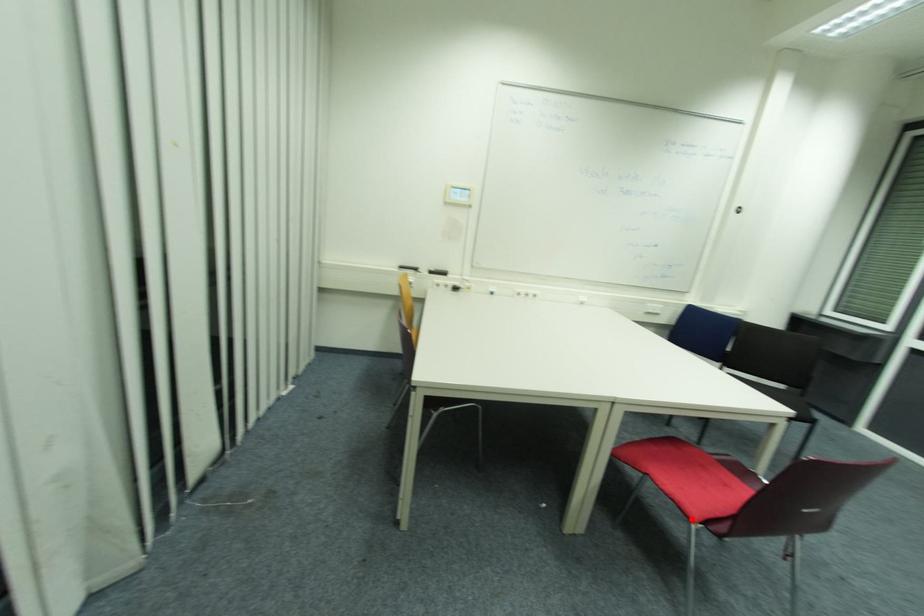
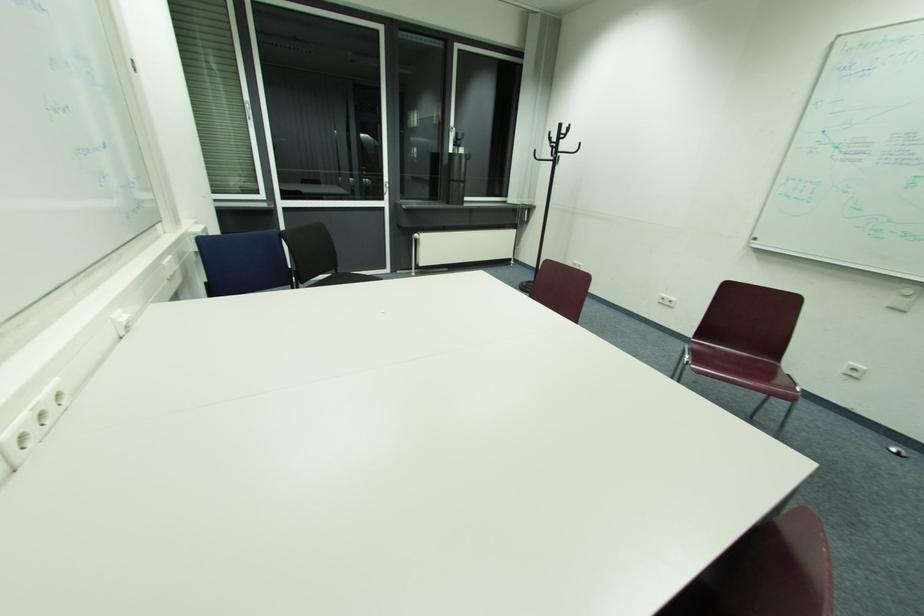
Question: I am providing you with two images of the same scene from different viewpoints. A red point is marked on the first image. At the location where the point appears in image 1, is it still visible in image 2?

Choices:
 (A) Yes
 (B) No

Answer: (B)